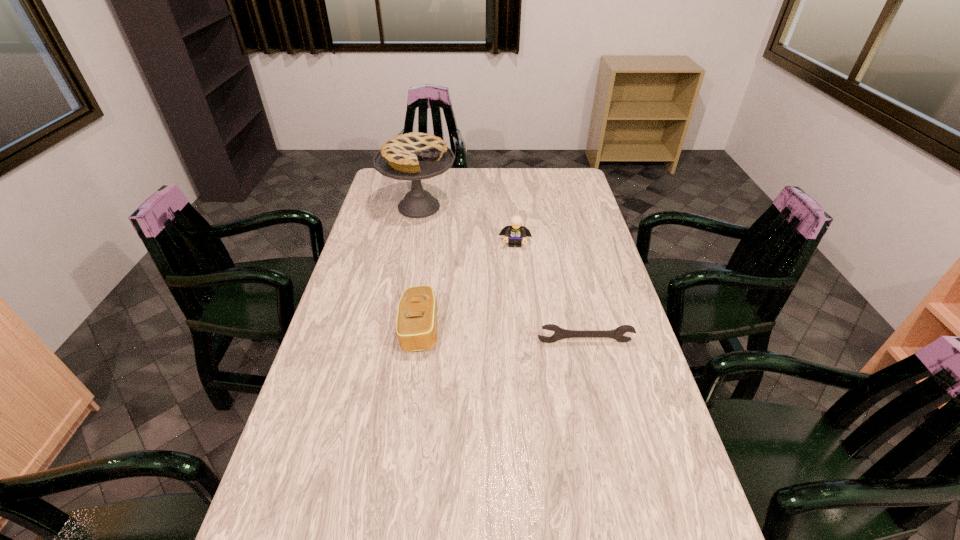
Where is `vacant space on the desktop that is between the second shortest object and the shortest object and is positioned on the front-facing side of the Lego`? The width and height of the screenshot is (960, 540). vacant space on the desktop that is between the second shortest object and the shortest object and is positioned on the front-facing side of the Lego is located at coordinates (513, 336).

Locate an element on the screen. The width and height of the screenshot is (960, 540). vacant space on the desktop that is between the second shortest object and the wrench and is positioned on the cut side of the farthest object is located at coordinates (516, 336).